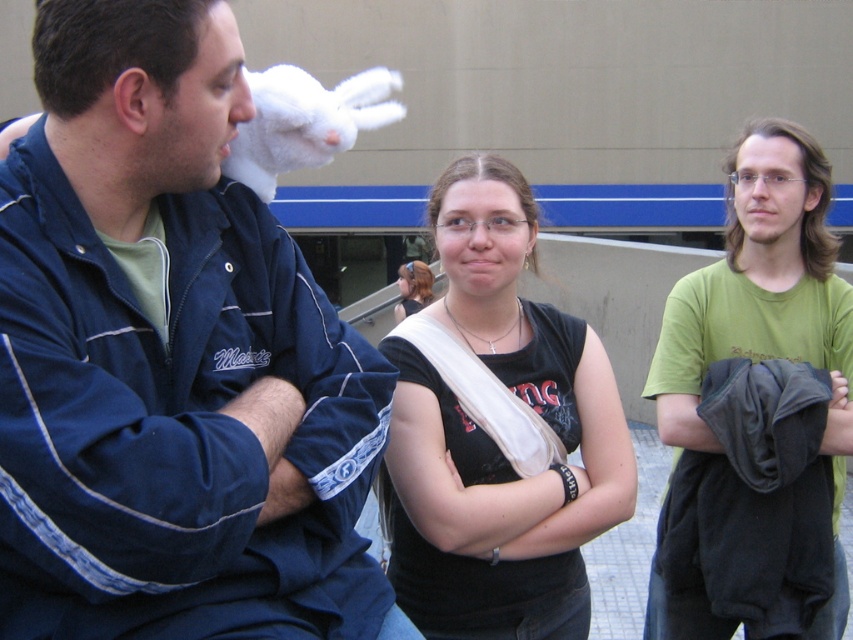
Is blue fabric jacket at left wider than white matte glove at upper left?

Correct, the width of blue fabric jacket at left exceeds that of white matte glove at upper left.

Looking at this image, which is above, blue fabric jacket at left or white matte glove at upper left?

Positioned higher is white matte glove at upper left.

Is point (70, 145) less distant than point (234, 99)?

Yes, point (70, 145) is closer to viewer.

Locate an element on the screen. blue fabric jacket at left is located at coordinates (170, 362).

Does point (160, 337) come behind point (543, 484)?

No, it is not.

Which is above, blue fabric jacket at left or black matte tank top at center?

Positioned higher is blue fabric jacket at left.

Between point (137, 525) and point (548, 557), which one is positioned in front?

Positioned in front is point (137, 525).

The width and height of the screenshot is (853, 640). Find the location of `blue fabric jacket at left`. blue fabric jacket at left is located at coordinates (170, 362).

Is the position of matte skin nose at center more distant than that of translucent plastic nose at center?

A: No, it is in front of translucent plastic nose at center.

You are a GUI agent. You are given a task and a screenshot of the screen. Output one action in this format:
    pyautogui.click(x=<x>, y=<y>)
    Task: Click on the matte skin nose at center
    
    Given the screenshot: What is the action you would take?
    pyautogui.click(x=483, y=234)

Does point (492, 237) lie in front of point (746, 182)?

That is True.

Identify the location of matte skin nose at center. (483, 234).